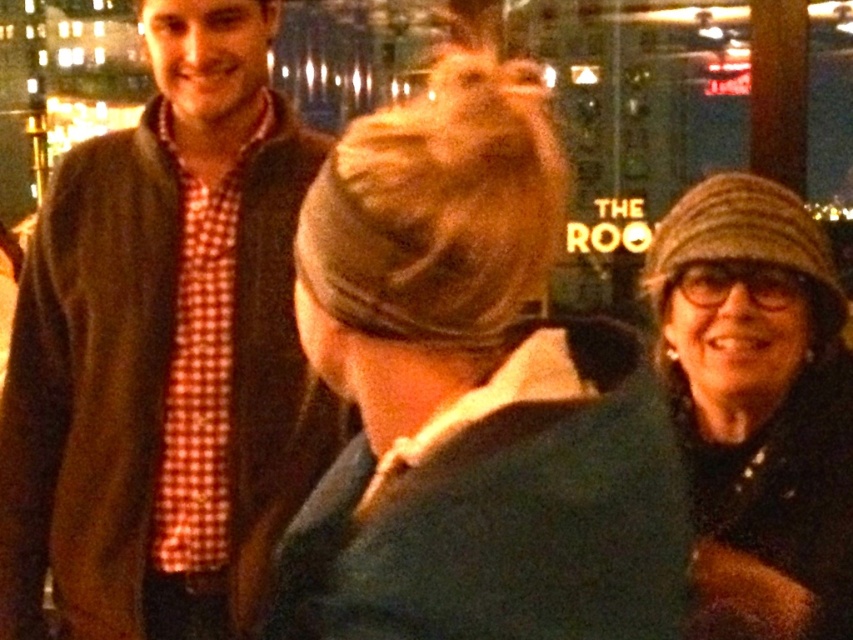
Is point (57, 440) more distant than point (766, 419)?

That is True.

Is matte brown jacket at left to the right of striped wool hat at right from the viewer's perspective?

Incorrect, matte brown jacket at left is not on the right side of striped wool hat at right.

Looking at this image, who is more distant from viewer, (230, 324) or (811, 394)?

The point (230, 324) is behind.

This screenshot has width=853, height=640. What are the coordinates of `matte brown jacket at left` in the screenshot? It's located at (164, 353).

Does dark green fabric coat at center appear on the right side of striped wool hat at right?

In fact, dark green fabric coat at center is to the left of striped wool hat at right.

Does dark green fabric coat at center have a greater width compared to striped wool hat at right?

Yes.

This screenshot has width=853, height=640. What do you see at coordinates (471, 394) in the screenshot?
I see `dark green fabric coat at center` at bounding box center [471, 394].

Locate an element on the screen. This screenshot has width=853, height=640. dark green fabric coat at center is located at coordinates (471, 394).

Between dark green fabric coat at center and matte brown jacket at left, which one has less height?

dark green fabric coat at center is shorter.

Who is positioned more to the right, dark green fabric coat at center or matte brown jacket at left?

From the viewer's perspective, dark green fabric coat at center appears more on the right side.

Is point (450, 152) behind point (131, 444)?

No, it is not.

What are the coordinates of `dark green fabric coat at center` in the screenshot? It's located at click(x=471, y=394).